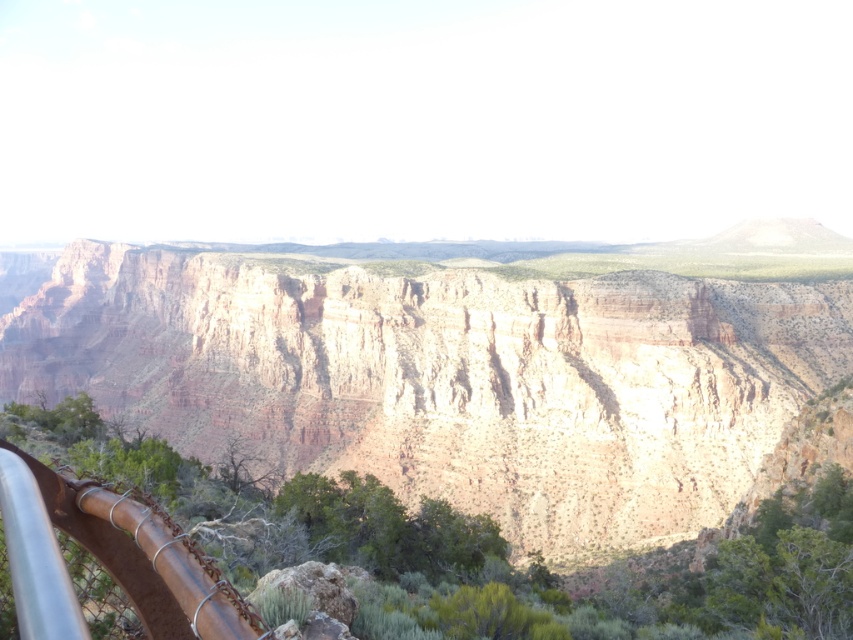
You are a GUI agent. You are given a task and a screenshot of the screen. Output one action in this format:
    pyautogui.click(x=<x>, y=<y>)
    Task: Click on the rustic rock formation at center
    This screenshot has width=853, height=640.
    Given the screenshot: What is the action you would take?
    pyautogui.click(x=463, y=376)

Can you confirm if rustic rock formation at center is wider than rusty metal rail at lower left?

Yes, rustic rock formation at center is wider than rusty metal rail at lower left.

Find the location of a particular element. The width and height of the screenshot is (853, 640). rustic rock formation at center is located at coordinates (463, 376).